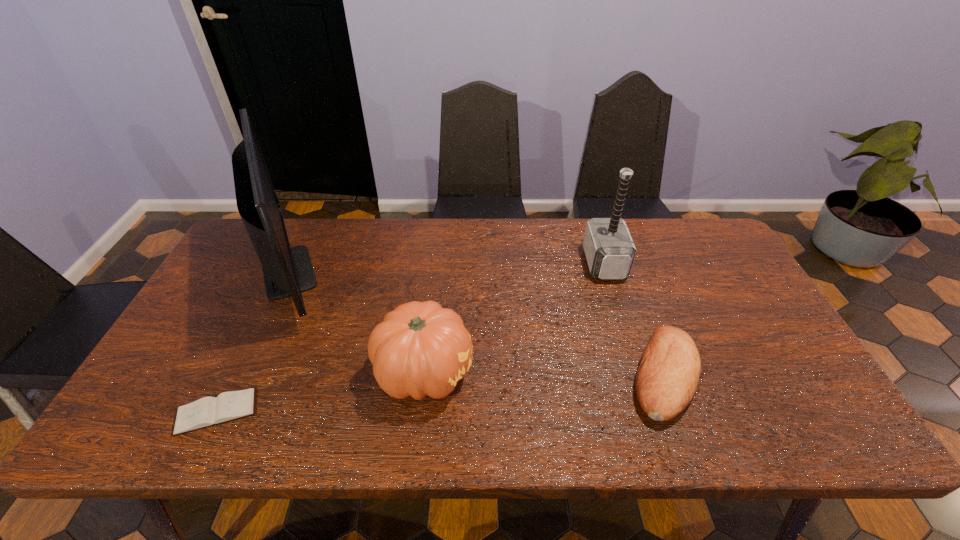
This screenshot has width=960, height=540. Find the location of `object that is at the far left corner`. object that is at the far left corner is located at coordinates click(x=288, y=271).

Locate an element on the screen. This screenshot has height=540, width=960. object present at the near left corner is located at coordinates (208, 411).

Locate an element on the screen. vacant space at the far edge is located at coordinates (324, 224).

Identify the location of blank area at the near edge. (593, 430).

In the image, there is a desktop. Where is `vacant area at the left edge`? The height and width of the screenshot is (540, 960). vacant area at the left edge is located at coordinates (202, 341).

In the image, there is a desktop. What are the coordinates of `vacant space at the right edge` in the screenshot? It's located at (756, 337).

In the image, there is a desktop. Identify the location of free space at the far right corner. This screenshot has width=960, height=540. (686, 261).

Locate an element on the screen. free area in between the third object from left to right and the bread is located at coordinates [x=544, y=374].

Locate an element on the screen. vacant area that lies between the tallest object and the second shortest object is located at coordinates (479, 323).

The image size is (960, 540). In order to click on free spot between the bread and the hammer in this screenshot , I will do `click(635, 320)`.